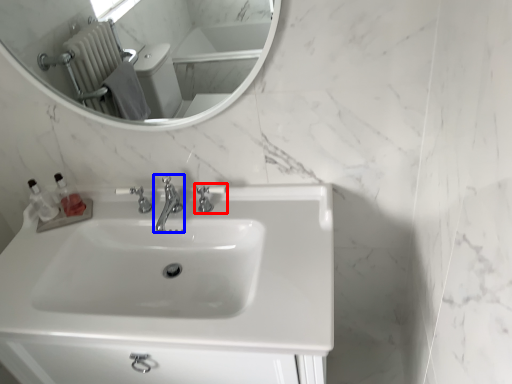
Question: Which object appears farthest to the camera in this image, tap (highlighted by a red box) or tap (highlighted by a blue box)?

Choices:
 (A) tap
 (B) tap

Answer: (A)